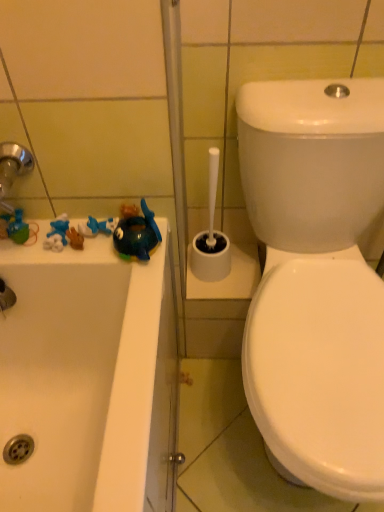
Question: Is matte green toy at left, the third toy viewed from the right, in contact with glossy plastic toy at left, the 1th toy from the right?

Choices:
 (A) no
 (B) yes

Answer: (A)

Question: Are matte green toy at left, the third toy viewed from the right, and glossy plastic toy at left, the 1th toy from the right, far apart?

Choices:
 (A) no
 (B) yes

Answer: (A)

Question: Considering the relative sizes of matte green toy at left, the third toy viewed from the right, and glossy plastic toy at left, acting as the third toy starting from the left, in the image provided, is matte green toy at left, the third toy viewed from the right, wider than glossy plastic toy at left, acting as the third toy starting from the left,?

Choices:
 (A) no
 (B) yes

Answer: (A)

Question: Considering the relative positions of matte green toy at left, acting as the first toy starting from the left, and glossy plastic toy at left, acting as the third toy starting from the left, in the image provided, is matte green toy at left, acting as the first toy starting from the left, to the left of glossy plastic toy at left, acting as the third toy starting from the left, from the viewer's perspective?

Choices:
 (A) no
 (B) yes

Answer: (B)

Question: From a real-world perspective, is matte green toy at left, acting as the first toy starting from the left, beneath glossy plastic toy at left, the 1th toy from the right?

Choices:
 (A) no
 (B) yes

Answer: (B)

Question: From the image's perspective, is matte green toy at left, the third toy viewed from the right, above or below glossy plastic toy at left, the 1th toy from the right?

Choices:
 (A) above
 (B) below

Answer: (A)

Question: Considering the relative positions of matte green toy at left, the third toy viewed from the right, and glossy plastic toy at left, the 1th toy from the right, in the image provided, is matte green toy at left, the third toy viewed from the right, to the left or to the right of glossy plastic toy at left, the 1th toy from the right,?

Choices:
 (A) right
 (B) left

Answer: (B)

Question: From their relative heights in the image, would you say matte green toy at left, acting as the first toy starting from the left, is taller or shorter than glossy plastic toy at left, the 1th toy from the right?

Choices:
 (A) short
 (B) tall

Answer: (A)

Question: From a real-world perspective, is matte green toy at left, the third toy viewed from the right, physically located above or below glossy plastic toy at left, the 1th toy from the right?

Choices:
 (A) above
 (B) below

Answer: (B)

Question: Considering the positions of glossy plastic toy at left, the 1th toy from the right, and blue rubber toy at left, the second toy positioned from the left, in the image, is glossy plastic toy at left, the 1th toy from the right, taller or shorter than blue rubber toy at left, the second toy positioned from the left,?

Choices:
 (A) tall
 (B) short

Answer: (A)

Question: Would you say glossy plastic toy at left, acting as the third toy starting from the left, is inside or outside blue rubber toy at left, the second toy positioned from the left?

Choices:
 (A) inside
 (B) outside

Answer: (B)

Question: In terms of width, does glossy plastic toy at left, the 1th toy from the right, look wider or thinner when compared to blue rubber toy at left, which is the 2th toy in right-to-left order?

Choices:
 (A) thin
 (B) wide

Answer: (B)

Question: From a real-world perspective, relative to blue rubber toy at left, the second toy positioned from the left, is glossy plastic toy at left, the 1th toy from the right, vertically above or below?

Choices:
 (A) below
 (B) above

Answer: (B)

Question: From the image's perspective, is white plastic toilet brush holder at center above or below matte green toy at left, acting as the first toy starting from the left?

Choices:
 (A) below
 (B) above

Answer: (B)

Question: Is point (215, 243) positioned closer to the camera than point (14, 226)?

Choices:
 (A) farther
 (B) closer

Answer: (A)